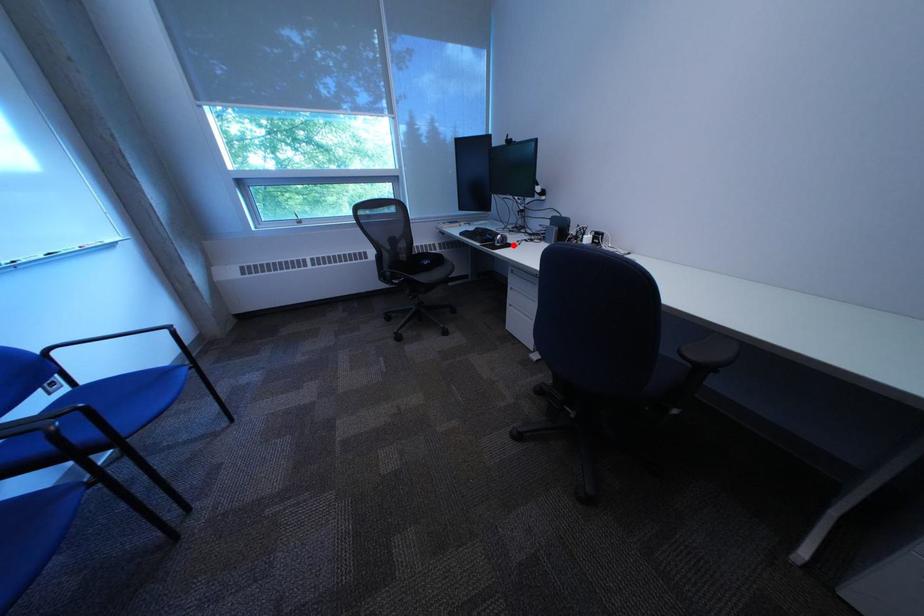
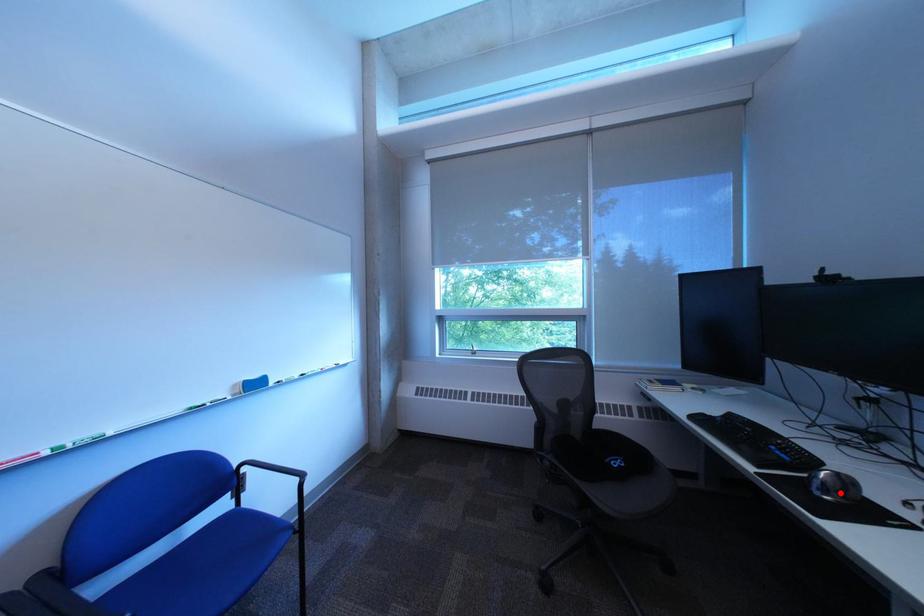
I am providing you with two images of the same scene from different viewpoints. A red point is marked on the first image and another point is marked on the second image. Are the points marked in image1 and image2 representing the same 3D position?

Yes